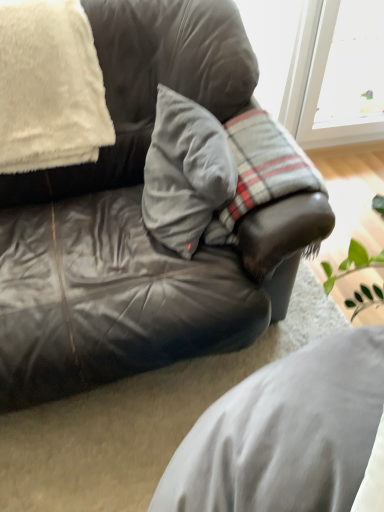
Question: Does gray cotton pillow at center, the 2th pillow when ordered from left to right, appear on the right side of matte gray leather couch at center?

Choices:
 (A) no
 (B) yes

Answer: (B)

Question: Is gray cotton pillow at center, the 2th pillow when ordered from left to right, closer to camera compared to matte gray leather couch at center?

Choices:
 (A) yes
 (B) no

Answer: (B)

Question: Is gray cotton pillow at center, positioned as the 1th pillow in right-to-left order, oriented towards matte gray leather couch at center?

Choices:
 (A) yes
 (B) no

Answer: (A)

Question: Can you confirm if gray cotton pillow at center, the 2th pillow when ordered from left to right, is thinner than matte gray leather couch at center?

Choices:
 (A) no
 (B) yes

Answer: (B)

Question: Can you confirm if gray cotton pillow at center, positioned as the 1th pillow in right-to-left order, is bigger than matte gray leather couch at center?

Choices:
 (A) no
 (B) yes

Answer: (A)

Question: From a real-world perspective, is matte gray leather couch at center above or below leather cushion at center?

Choices:
 (A) above
 (B) below

Answer: (A)

Question: Looking at their shapes, would you say matte gray leather couch at center is wider or thinner than leather cushion at center?

Choices:
 (A) thin
 (B) wide

Answer: (B)

Question: Is matte gray leather couch at center taller or shorter than leather cushion at center?

Choices:
 (A) tall
 (B) short

Answer: (A)

Question: Does point (175, 321) appear closer or farther from the camera than point (221, 453)?

Choices:
 (A) farther
 (B) closer

Answer: (A)

Question: In terms of width, does matte gray leather couch at center look wider or thinner when compared to white fluffy blanket at upper left, positioned as the 2th pillow in right-to-left order?

Choices:
 (A) thin
 (B) wide

Answer: (B)

Question: Choose the correct answer: Is matte gray leather couch at center inside white fluffy blanket at upper left, positioned as the 2th pillow in right-to-left order, or outside it?

Choices:
 (A) outside
 (B) inside

Answer: (A)

Question: Does point (1, 271) appear closer or farther from the camera than point (41, 51)?

Choices:
 (A) closer
 (B) farther

Answer: (A)

Question: Considering the relative positions of matte gray leather couch at center and white fluffy blanket at upper left, which ranks as the first pillow in left-to-right order, in the image provided, is matte gray leather couch at center to the left or to the right of white fluffy blanket at upper left, which ranks as the first pillow in left-to-right order,?

Choices:
 (A) right
 (B) left

Answer: (A)

Question: From a real-world perspective, is white fluffy blanket at upper left, which ranks as the first pillow in left-to-right order, positioned above or below leather cushion at center?

Choices:
 (A) above
 (B) below

Answer: (A)

Question: Would you say white fluffy blanket at upper left, positioned as the 2th pillow in right-to-left order, is to the left or to the right of leather cushion at center in the picture?

Choices:
 (A) right
 (B) left

Answer: (B)